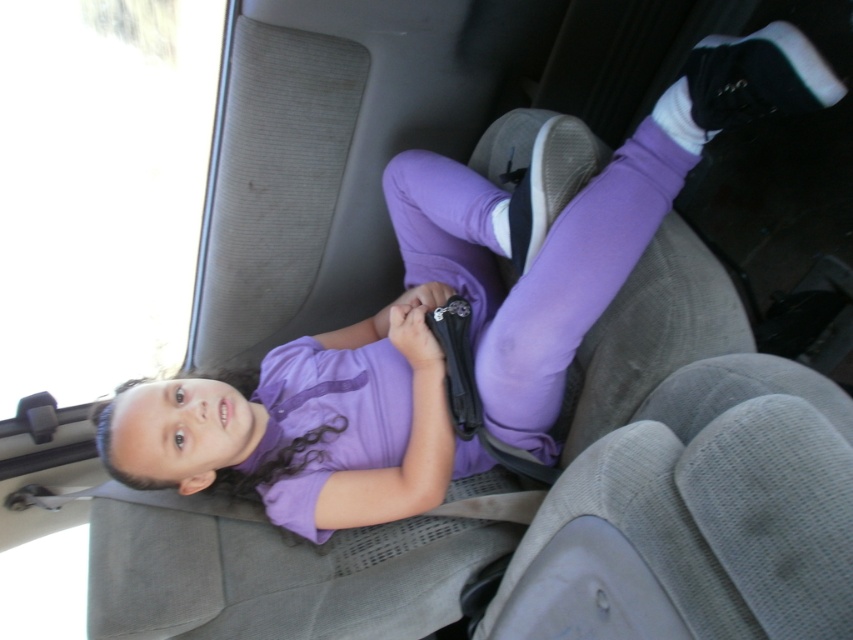
Question: Which object appears closest to the camera in this image?

Choices:
 (A) black fabric strap at center
 (B) purple matte shirt at center

Answer: (B)

Question: Can you confirm if purple matte shirt at center is thinner than black fabric strap at center?

Choices:
 (A) yes
 (B) no

Answer: (B)

Question: In this image, where is purple matte shirt at center located relative to black fabric strap at center?

Choices:
 (A) right
 (B) left

Answer: (B)

Question: Which point is closer to the camera?

Choices:
 (A) (257, 445)
 (B) (430, 321)

Answer: (B)

Question: Observing the image, what is the correct spatial positioning of purple matte shirt at center in reference to black fabric strap at center?

Choices:
 (A) right
 (B) left

Answer: (B)